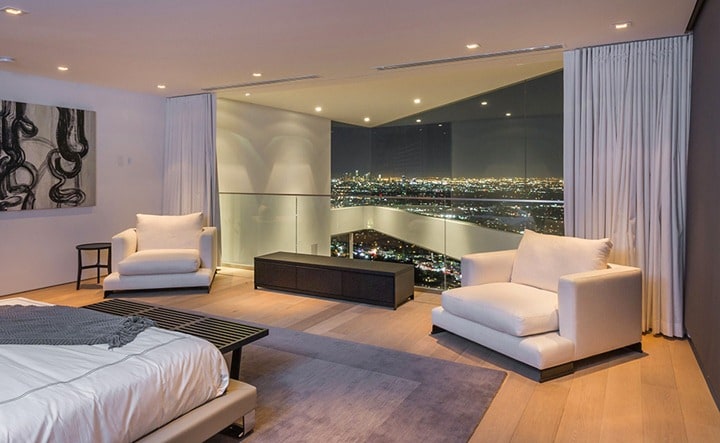
Image resolution: width=720 pixels, height=443 pixels. I want to click on blanket, so click(81, 327).